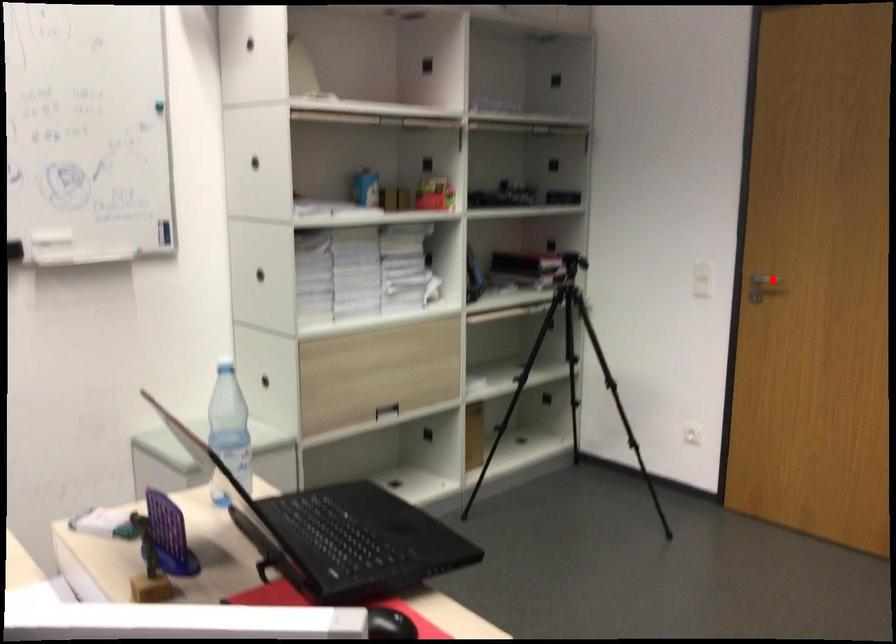
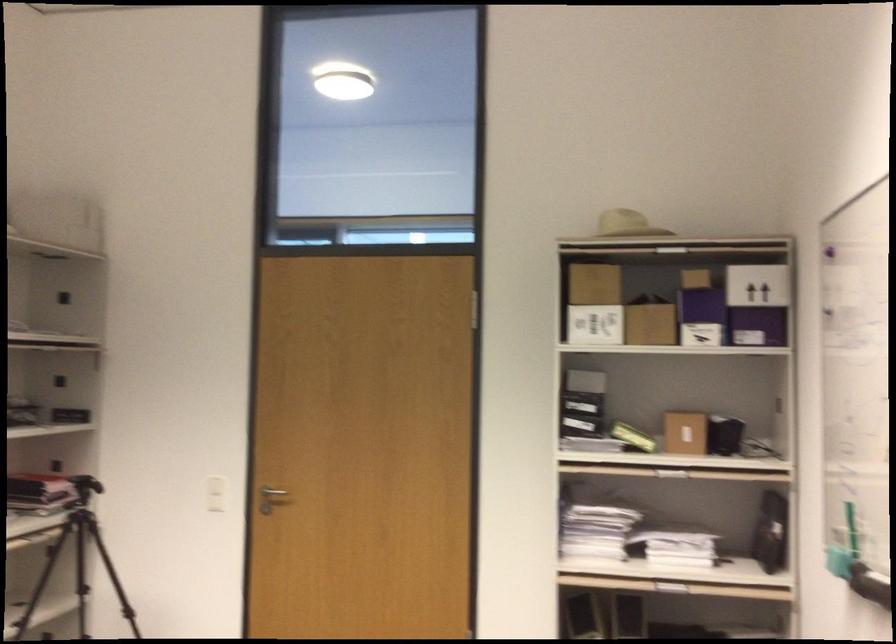
In the second image, find the point that corresponds to the highlighted location in the first image.

(272, 491)